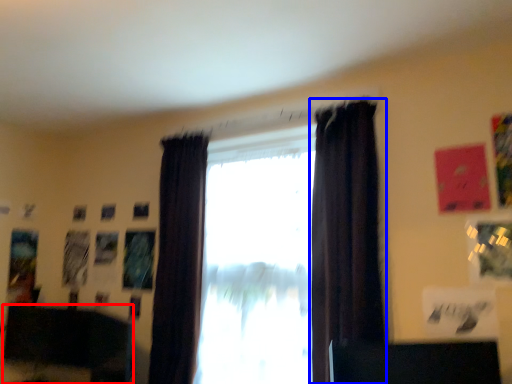
Question: Which object appears closest to the camera in this image, furniture (highlighted by a red box) or curtain (highlighted by a blue box)?

Choices:
 (A) furniture
 (B) curtain

Answer: (B)